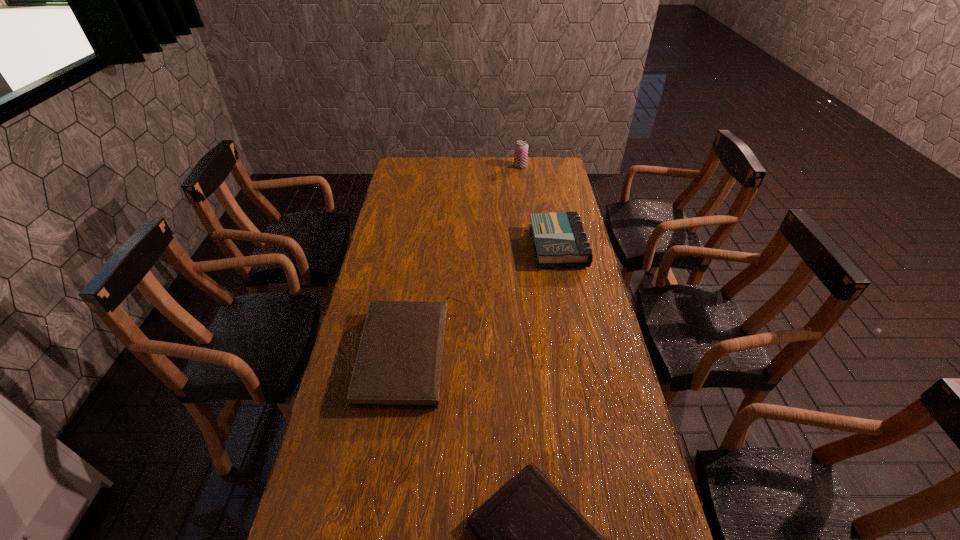
The height and width of the screenshot is (540, 960). What are the coordinates of `the tallest object` in the screenshot? It's located at (521, 147).

The width and height of the screenshot is (960, 540). I want to click on the farthest object, so click(521, 147).

Locate an element on the screen. the second tallest object is located at coordinates (558, 238).

Locate an element on the screen. the farthest paperback book is located at coordinates (558, 238).

Identify the location of the second shortest paperback book. Image resolution: width=960 pixels, height=540 pixels. (399, 361).

The height and width of the screenshot is (540, 960). I want to click on the second nearest paperback book, so click(399, 361).

At what (x,y) coordinates should I click in order to perform the action: click on vacant space located on the front of the beer can. Please return your answer as a coordinate pair (x, y). The height and width of the screenshot is (540, 960). Looking at the image, I should click on (524, 198).

In order to click on vacant region located on the left of the second farthest object in this screenshot , I will do (x=465, y=247).

Locate an element on the screen. This screenshot has height=540, width=960. vacant space positioned 0.350m on the spine side of the second nearest paperback book is located at coordinates (582, 354).

You are a GUI agent. You are given a task and a screenshot of the screen. Output one action in this format:
    pyautogui.click(x=<x>, y=<y>)
    Task: Click on the object present at the far edge
    The height and width of the screenshot is (540, 960).
    Given the screenshot: What is the action you would take?
    coord(521,147)